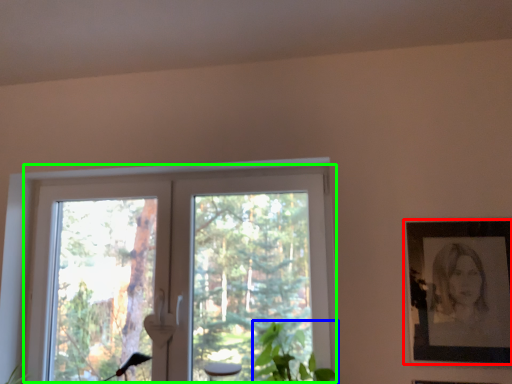
Question: Estimate the real-world distances between objects in this image. Which object is closer to picture frame (highlighted by a red box), plant (highlighted by a blue box) or window (highlighted by a green box)?

Choices:
 (A) plant
 (B) window

Answer: (A)